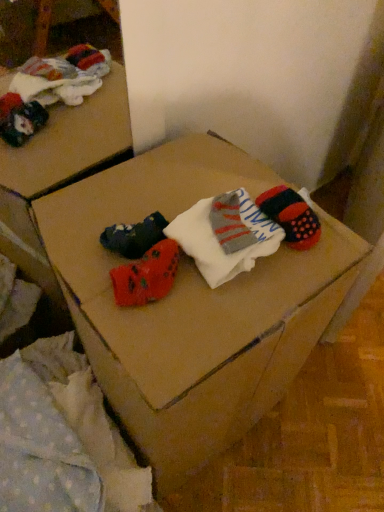
Locate an element on the screen. The image size is (384, 512). free space above cardboard box at center (from a real-world perspective) is located at coordinates (174, 239).